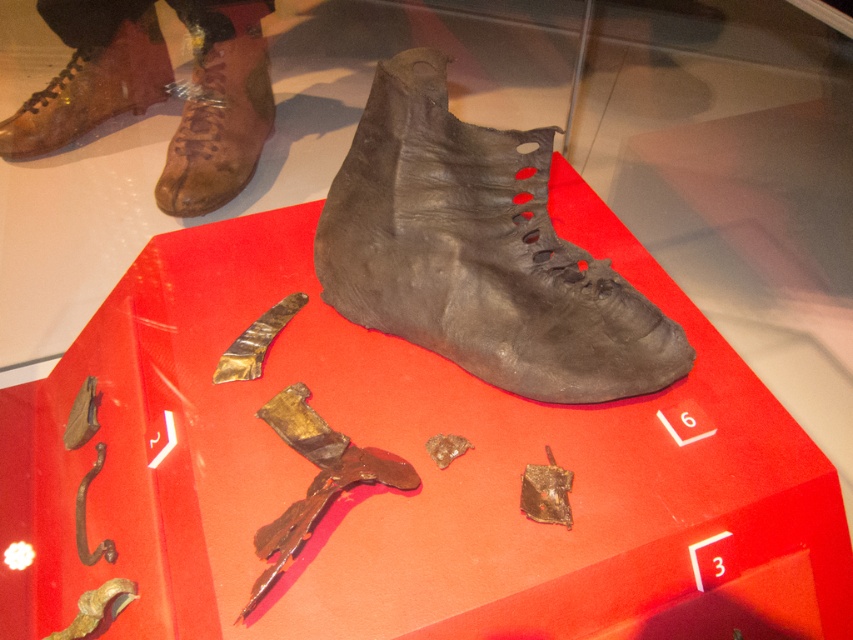
Question: Which object is closer to the camera taking this photo?

Choices:
 (A) matte black boot at center
 (B) leather boot at upper left

Answer: (A)

Question: Is matte black boot at center above matte leather boot at upper left?

Choices:
 (A) no
 (B) yes

Answer: (A)

Question: Estimate the real-world distances between objects in this image. Which object is farther from the matte leather boot at upper left?

Choices:
 (A) leather boot at upper left
 (B) matte black boot at center

Answer: (B)

Question: Is matte black boot at center bigger than matte leather boot at upper left?

Choices:
 (A) yes
 (B) no

Answer: (A)

Question: Can you confirm if matte black boot at center is positioned to the right of matte leather boot at upper left?

Choices:
 (A) yes
 (B) no

Answer: (A)

Question: Among these objects, which one is farthest from the camera?

Choices:
 (A) leather boot at upper left
 (B) matte leather boot at upper left
 (C) matte black boot at center

Answer: (B)